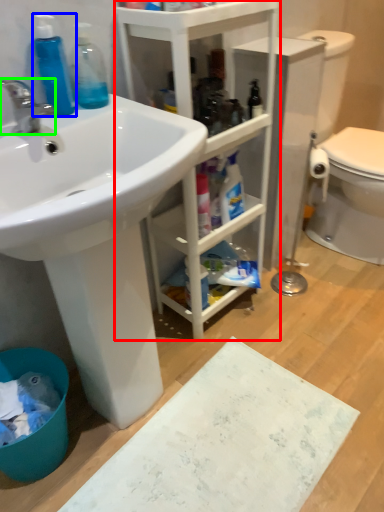
Question: Estimate the real-world distances between objects in this image. Which object is farther from bathroom cabinet (highlighted by a red box), cleaning product (highlighted by a blue box) or tap (highlighted by a green box)?

Choices:
 (A) cleaning product
 (B) tap

Answer: (B)